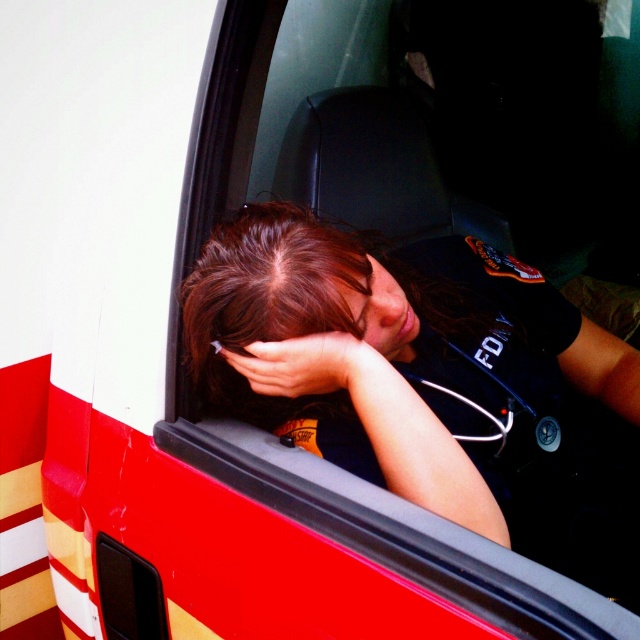
Between dark blue uniform at center and dark brown hair at center, which one appears on the left side from the viewer's perspective?

dark brown hair at center is more to the left.

Does dark blue uniform at center appear on the right side of dark brown hair at center?

Indeed, dark blue uniform at center is positioned on the right side of dark brown hair at center.

The image size is (640, 640). What do you see at coordinates (388, 352) in the screenshot?
I see `dark blue uniform at center` at bounding box center [388, 352].

Locate an element on the screen. dark blue uniform at center is located at coordinates (388, 352).

Does dark blue uniform at center appear under smooth skin hand at center?

Indeed, dark blue uniform at center is positioned under smooth skin hand at center.

Can you confirm if dark blue uniform at center is positioned to the left of smooth skin hand at center?

In fact, dark blue uniform at center is to the right of smooth skin hand at center.

Who is more distant from viewer, (392, 339) or (365, 378)?

Positioned behind is point (392, 339).

This screenshot has height=640, width=640. In order to click on dark blue uniform at center in this screenshot , I will do `click(388, 352)`.

Does point (332, 292) come closer to viewer compared to point (330, 365)?

Yes, point (332, 292) is in front of point (330, 365).

Looking at this image, who is more forward, (x=288, y=323) or (x=337, y=371)?

Positioned in front is point (x=288, y=323).

Is point (304, 410) positioned in front of point (308, 364)?

No, it is not.

Locate an element on the screen. Image resolution: width=640 pixels, height=640 pixels. dark brown hair at center is located at coordinates (268, 300).